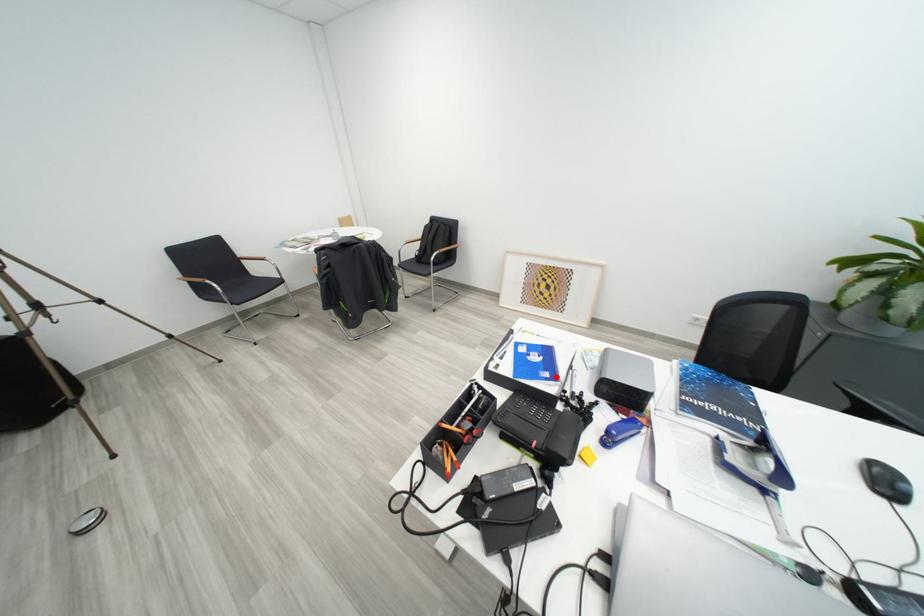
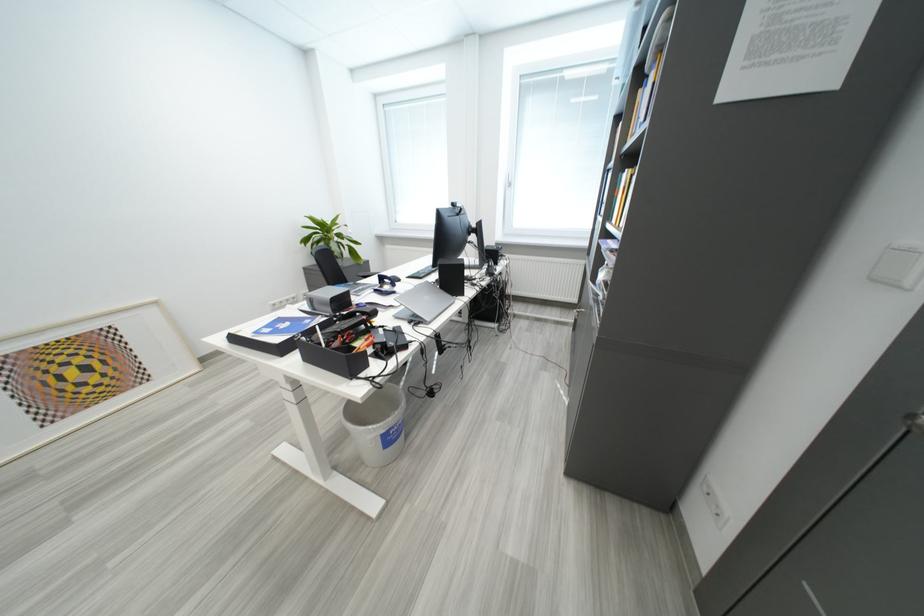
Locate, in the second image, the point that corresponds to the highlighted location in the first image.

(317, 323)